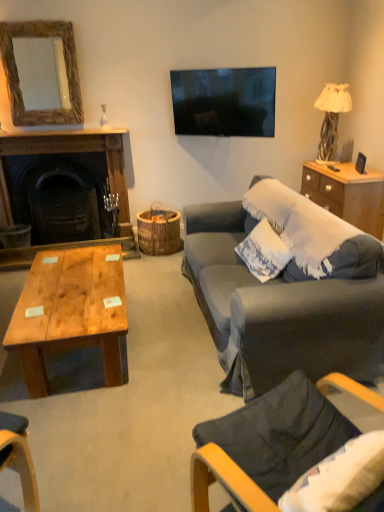
Identify the location of free space above wooden coffee table at center (from a real-world perspective). Image resolution: width=384 pixels, height=512 pixels. (71, 287).